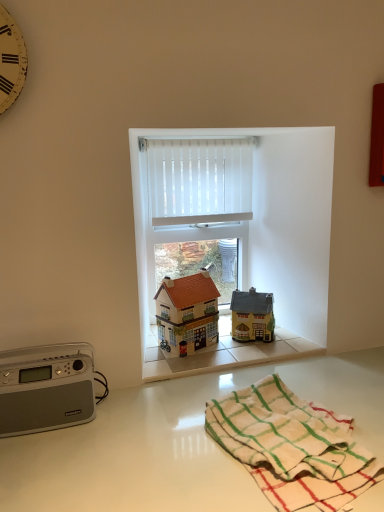
Where is `free location to the right of matte brown house at center, which ranks as the 1th toy in left-to-right order`? free location to the right of matte brown house at center, which ranks as the 1th toy in left-to-right order is located at coordinates (232, 348).